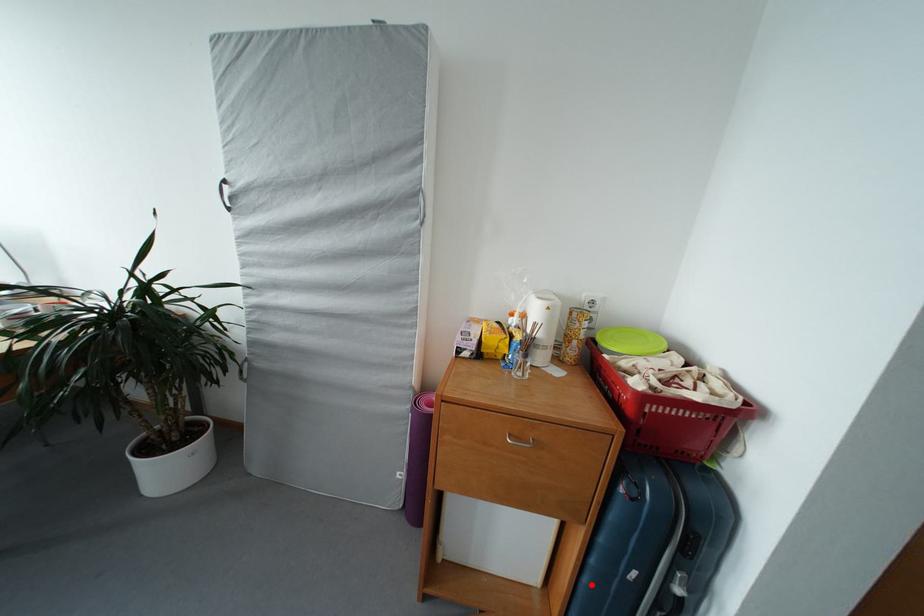
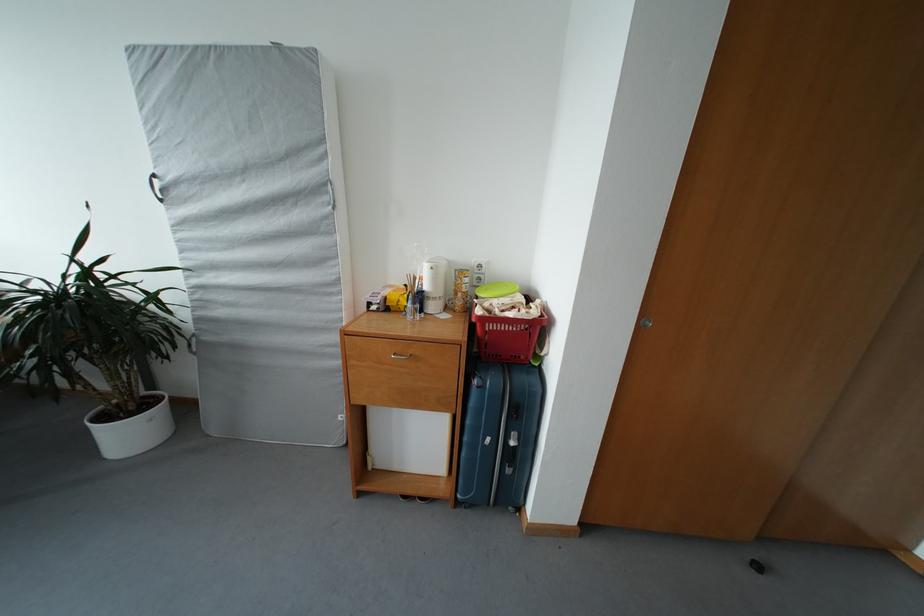
Question: I am providing you with two images of the same scene from different viewpoints. In image1, a red point is highlighted. Considering the same 3D point in image2, which of the following is correct?

Choices:
 (A) It is closer
 (B) It is farther

Answer: (B)